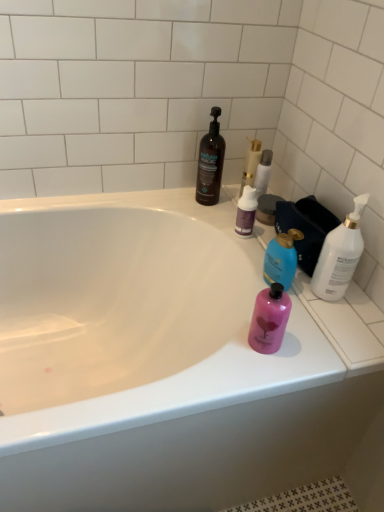
Locate an element on the screen. The width and height of the screenshot is (384, 512). free space in front of white glossy bottle at right, the 1th bottle in the right-to-left sequence is located at coordinates (329, 330).